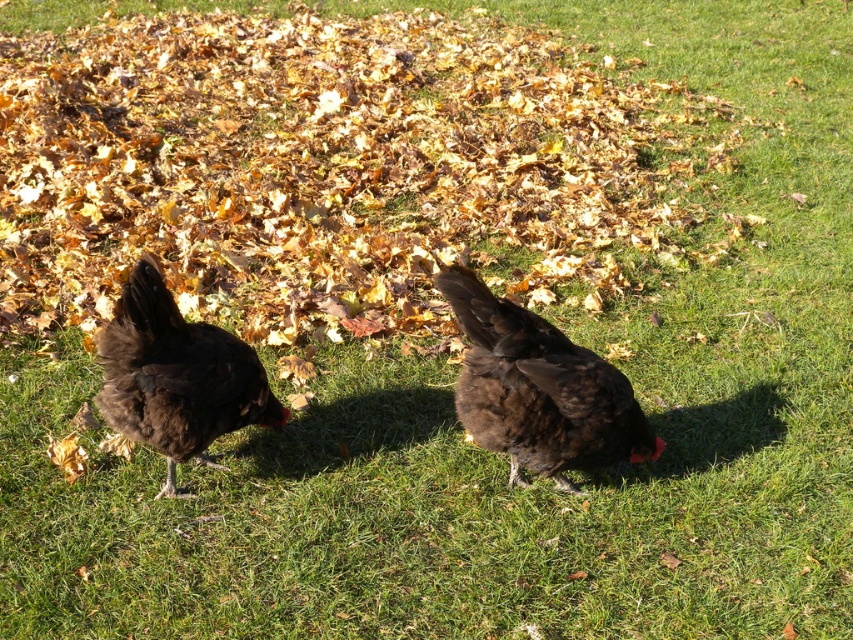
Question: Can you confirm if brown fuzzy chicken at center is thinner than brown fluffy chicken at left?

Choices:
 (A) no
 (B) yes

Answer: (A)

Question: Is brown fuzzy chicken at center above brown fluffy chicken at left?

Choices:
 (A) yes
 (B) no

Answer: (B)

Question: Which point is farther to the camera?

Choices:
 (A) (238, 390)
 (B) (567, 346)

Answer: (A)

Question: Does brown fuzzy chicken at center appear under brown fluffy chicken at left?

Choices:
 (A) no
 (B) yes

Answer: (B)